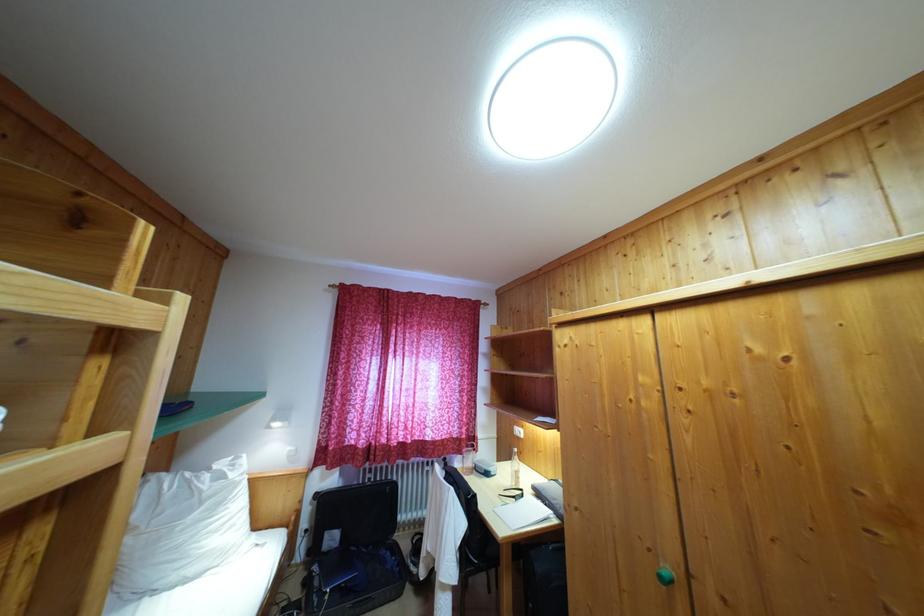
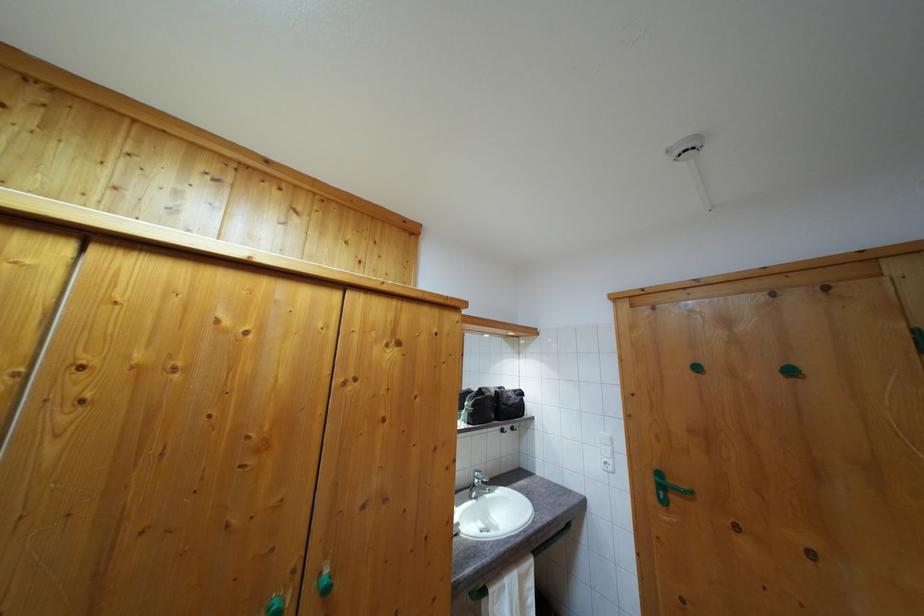
Question: How did the camera likely rotate?

Choices:
 (A) Left
 (B) Right
 (C) Up
 (D) Down

Answer: (B)